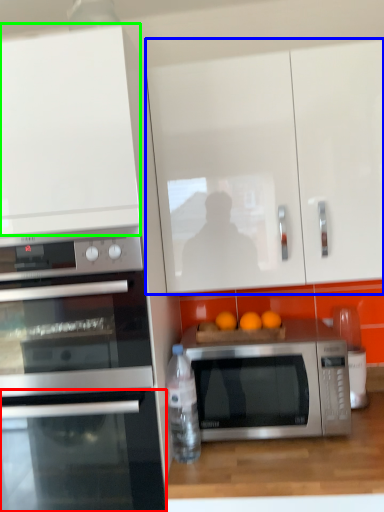
Question: Which object is positioned closest to oven (highlighted by a red box)? Select from cabinetry (highlighted by a blue box) and cabinetry (highlighted by a green box).

Choices:
 (A) cabinetry
 (B) cabinetry

Answer: (B)